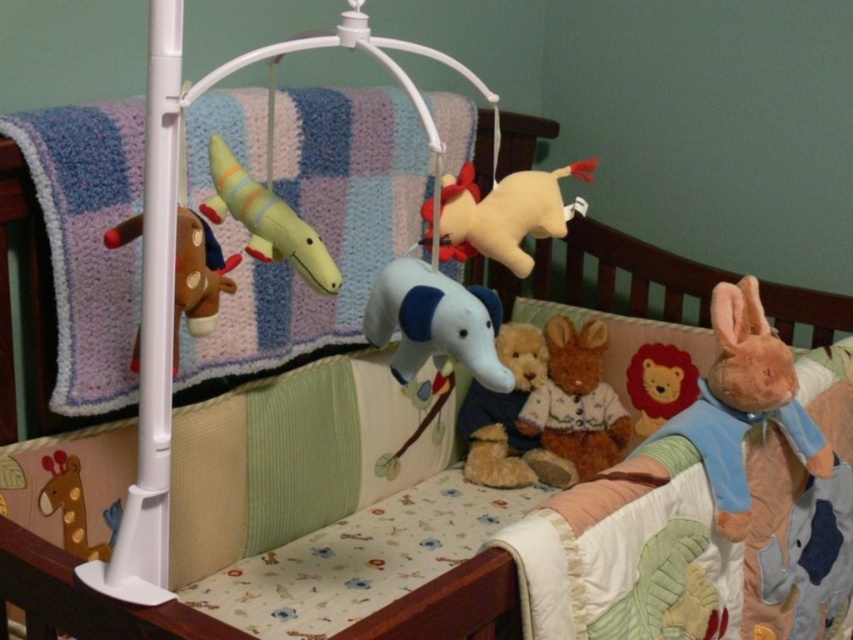
You are a parent checking the safety of the baby crib. The mobile has two toys, the brown plush horse at left and the matte yellow giraffe at lower left. Which toy should you be more concerned about if the baby might grab it first? Please explain based on their positions.

The matte yellow giraffe at lower left is positioned lower than the brown plush horse at left, so it is closer to the baby and more likely to be reached first. You should be more concerned about the matte yellow giraffe at lower left.

You are a parent checking the safety of the baby mobile in the crib. You see the matte yellow plush crocodile at upper center and the brown plush horse at left. Which toy is located to the right of the other?

The matte yellow plush crocodile at upper center is positioned on the right side of the brown plush horse at left.

You are a parent checking the safety of the baby crib. The recommended safe distance for hanging toys from a baby is at least 25 inches away from the crib. Is the brown plush rabbit at center positioned safely?

The brown plush rabbit at center is 1.72 meters from the viewer, which is approximately 67.8 inches. Since this distance exceeds the recommended 25 inches, the brown plush rabbit at center is positioned safely.